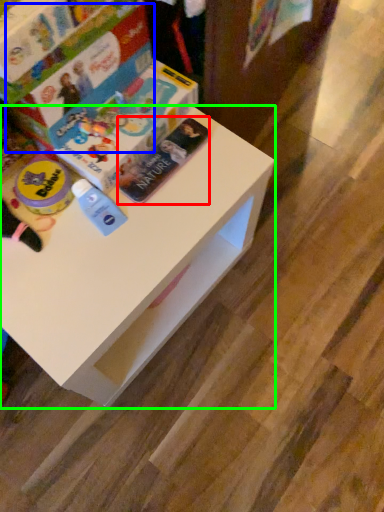
Question: Considering the real-world distances, which object is closest to paperback book (highlighted by a red box)? paperback book (highlighted by a blue box) or table (highlighted by a green box).

Choices:
 (A) paperback book
 (B) table

Answer: (A)